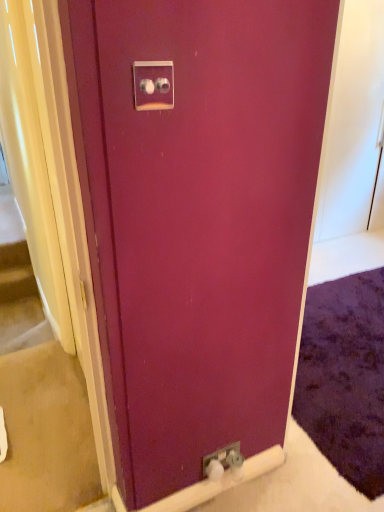
Question: Considering the relative sizes of satin silver switch at upper center, which is counted as the second electric outlet, starting from the back, and beige carpet at lower left in the image provided, is satin silver switch at upper center, which is counted as the second electric outlet, starting from the back, smaller than beige carpet at lower left?

Choices:
 (A) no
 (B) yes

Answer: (B)

Question: Considering the relative sizes of satin silver switch at upper center, the second electric outlet from the bottom, and beige carpet at lower left in the image provided, is satin silver switch at upper center, the second electric outlet from the bottom, shorter than beige carpet at lower left?

Choices:
 (A) no
 (B) yes

Answer: (A)

Question: Can you confirm if satin silver switch at upper center, which ranks as the second electric outlet in right-to-left order, is positioned to the right of beige carpet at lower left?

Choices:
 (A) yes
 (B) no

Answer: (A)

Question: Is satin silver switch at upper center, which ranks as the second electric outlet in right-to-left order, in contact with beige carpet at lower left?

Choices:
 (A) yes
 (B) no

Answer: (B)

Question: From a real-world perspective, is satin silver switch at upper center, positioned as the 1th electric outlet in front-to-back order, located beneath beige carpet at lower left?

Choices:
 (A) no
 (B) yes

Answer: (A)

Question: From a real-world perspective, is satin silver switch at upper center, marked as the first electric outlet in a left-to-right arrangement, physically located above or below beige carpet at lower left?

Choices:
 (A) below
 (B) above

Answer: (B)

Question: Do you think satin silver switch at upper center, which is counted as the second electric outlet, starting from the back, is within beige carpet at lower left, or outside of it?

Choices:
 (A) inside
 (B) outside

Answer: (B)

Question: In the image, is satin silver switch at upper center, positioned as the 1th electric outlet in front-to-back order, positioned in front of or behind beige carpet at lower left?

Choices:
 (A) front
 (B) behind

Answer: (A)

Question: Is satin silver switch at upper center, which is counted as the second electric outlet, starting from the back, wider or thinner than beige carpet at lower left?

Choices:
 (A) wide
 (B) thin

Answer: (B)

Question: From their relative heights in the image, would you say satin silver switch at upper center, marked as the first electric outlet in a left-to-right arrangement, is taller or shorter than metallic silver outlet at lower center, marked as the first electric outlet in a right-to-left arrangement?

Choices:
 (A) short
 (B) tall

Answer: (B)

Question: From a real-world perspective, is satin silver switch at upper center, which ranks as the second electric outlet in right-to-left order, above or below metallic silver outlet at lower center, marked as the first electric outlet in a right-to-left arrangement?

Choices:
 (A) below
 (B) above

Answer: (B)

Question: From the image's perspective, relative to metallic silver outlet at lower center, the 1th electric outlet viewed from the back, is satin silver switch at upper center, positioned as the 1th electric outlet in front-to-back order, above or below?

Choices:
 (A) above
 (B) below

Answer: (A)

Question: Considering the relative positions of satin silver switch at upper center, which is counted as the second electric outlet, starting from the back, and metallic silver outlet at lower center, marked as the first electric outlet in a right-to-left arrangement, in the image provided, is satin silver switch at upper center, which is counted as the second electric outlet, starting from the back, to the left or to the right of metallic silver outlet at lower center, marked as the first electric outlet in a right-to-left arrangement,?

Choices:
 (A) right
 (B) left

Answer: (B)

Question: Considering the positions of point (9, 330) and point (150, 95), is point (9, 330) closer or farther from the camera than point (150, 95)?

Choices:
 (A) farther
 (B) closer

Answer: (A)

Question: Do you think beige carpet at lower left is within satin silver switch at upper center, the 1th electric outlet from the top, or outside of it?

Choices:
 (A) outside
 (B) inside

Answer: (A)